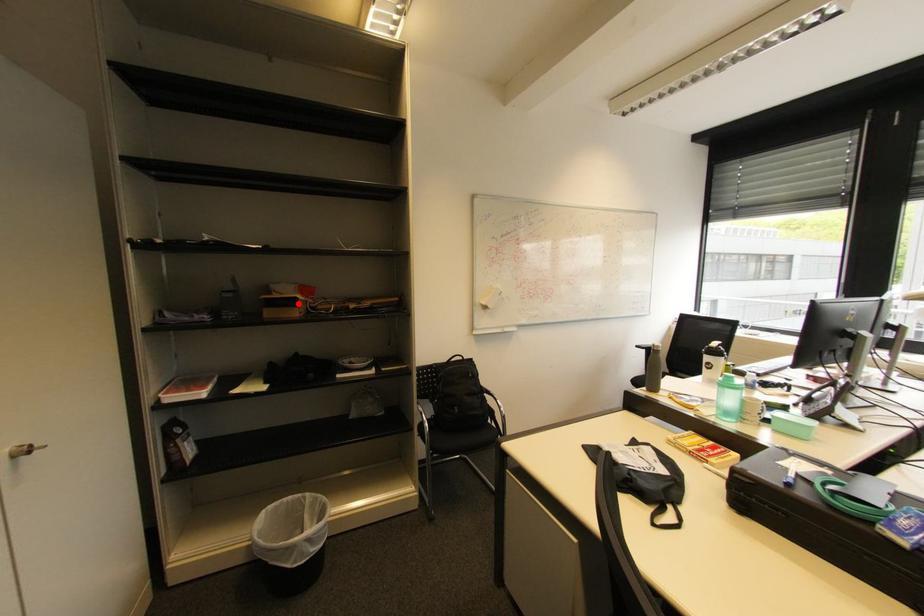
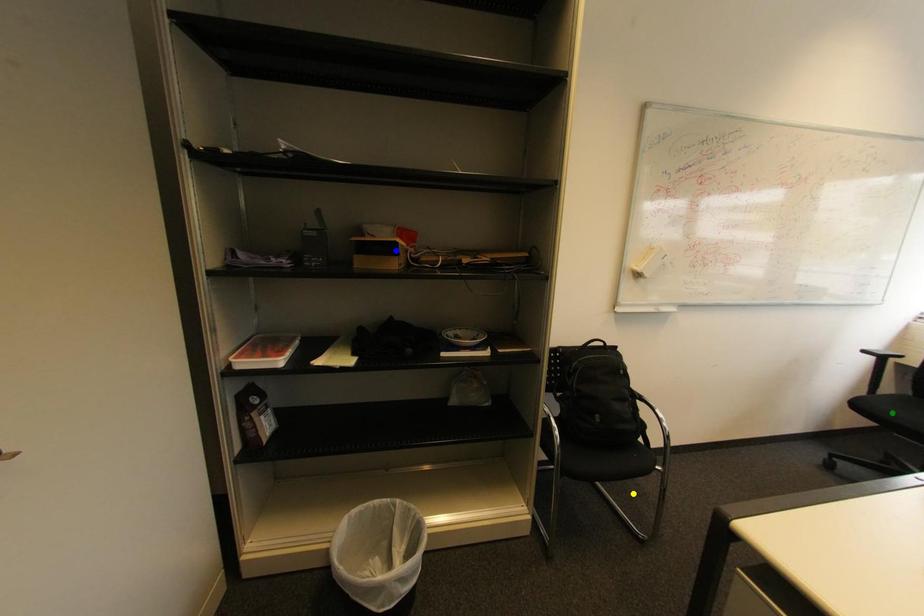
Question: I am providing you with two images of the same scene from different viewpoints. A red point is marked on the first image. You are given multiple points on the second image. Can you choose the point in image 2 that corresponds to the point in image 1?

Choices:
 (A) blue point
 (B) green point
 (C) yellow point

Answer: (A)